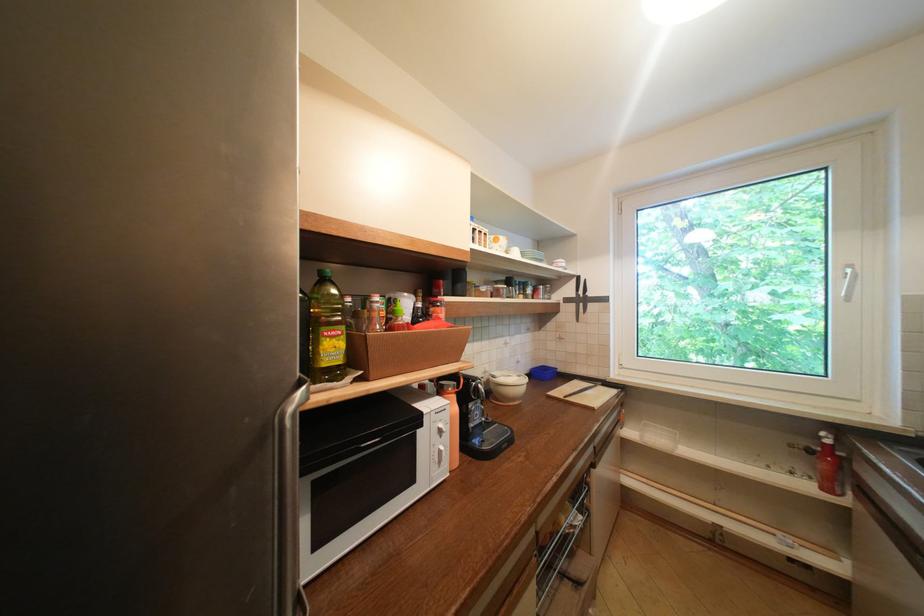
Where is `ceramic lid handle`? The image size is (924, 616). ceramic lid handle is located at coordinates (565, 392).